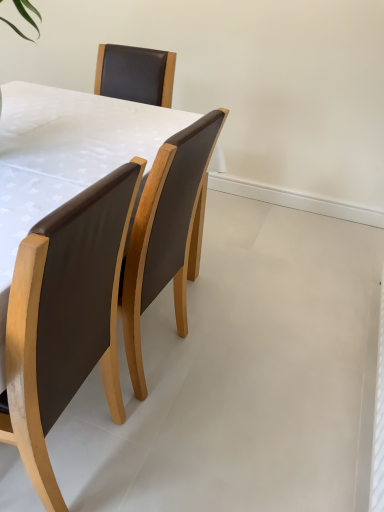
Find the location of a particular element. free space in front of brown leather table at center is located at coordinates (174, 434).